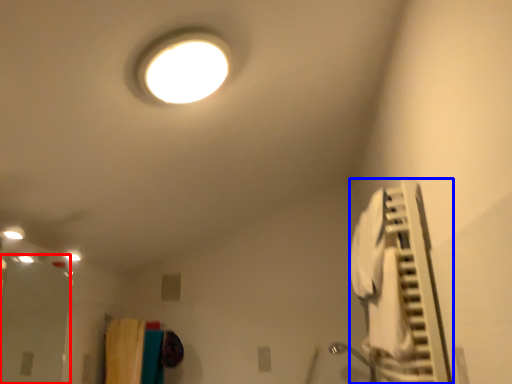
Question: Which of the following is the closest to the observer, glass door (highlighted by a red box) or air conditioner (highlighted by a blue box)?

Choices:
 (A) glass door
 (B) air conditioner

Answer: (B)